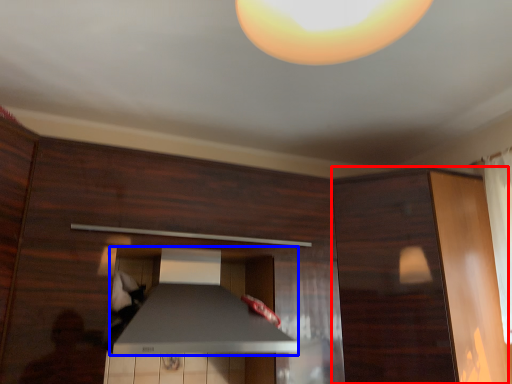
Question: Among these objects, which one is farthest to the camera, cabinetry (highlighted by a red box) or exhaust hood (highlighted by a blue box)?

Choices:
 (A) cabinetry
 (B) exhaust hood

Answer: (A)